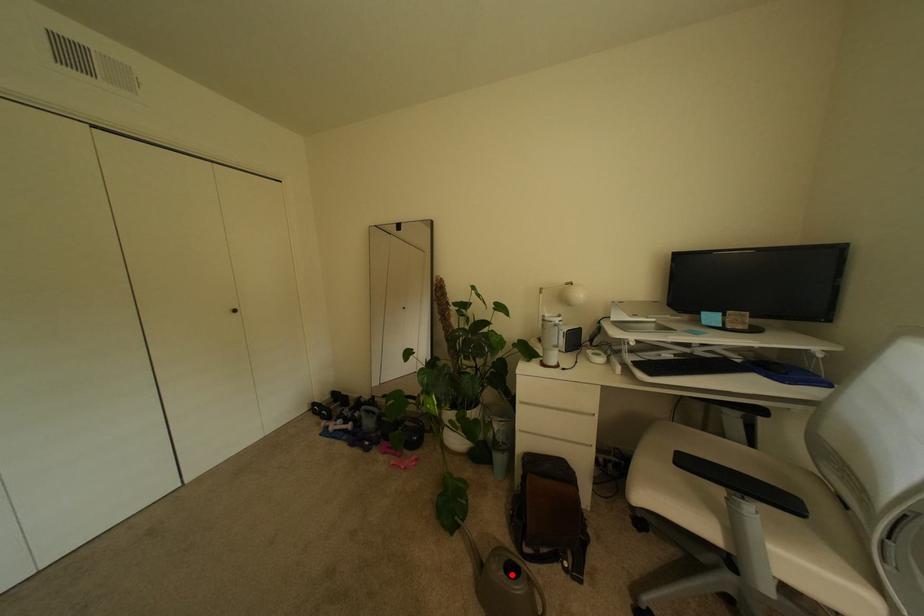
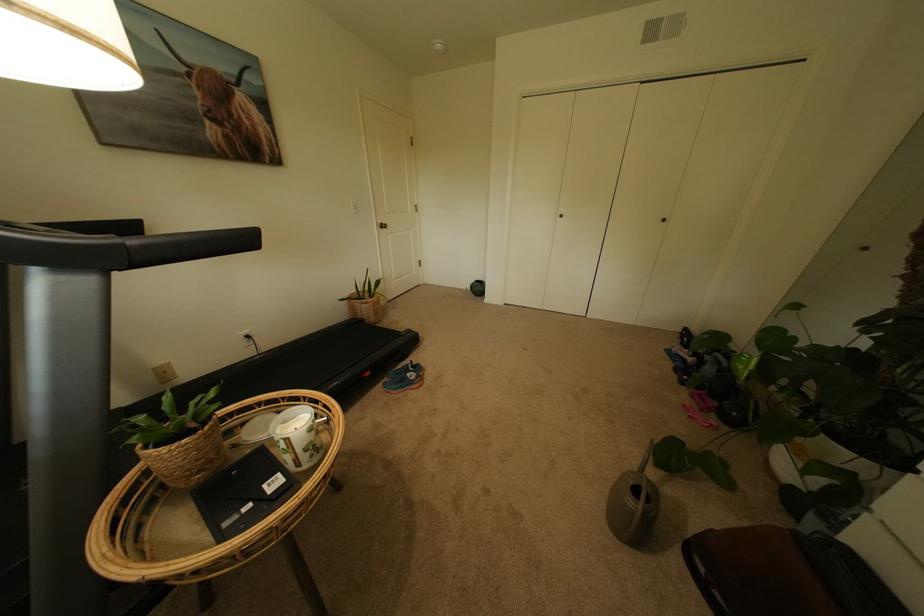
Question: I am providing you with two images of the same scene from different viewpoints. Image1 has a red point marked. In image2, the corresponding 3D location appears at what relative position? Reply with the corresponding letter.

Choices:
 (A) Closer
 (B) Farther

Answer: (A)